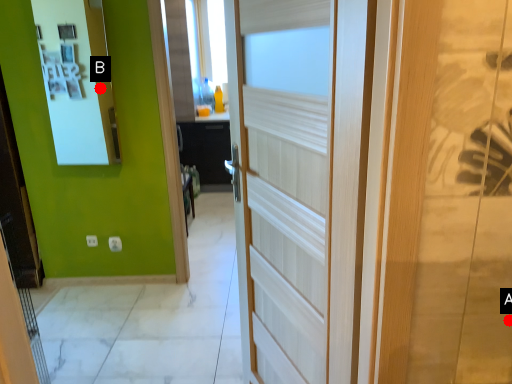
Question: Two points are circled on the image, labeled by A and B beside each circle. Which point is closer to the camera taking this photo?

Choices:
 (A) A is closer
 (B) B is closer

Answer: (A)